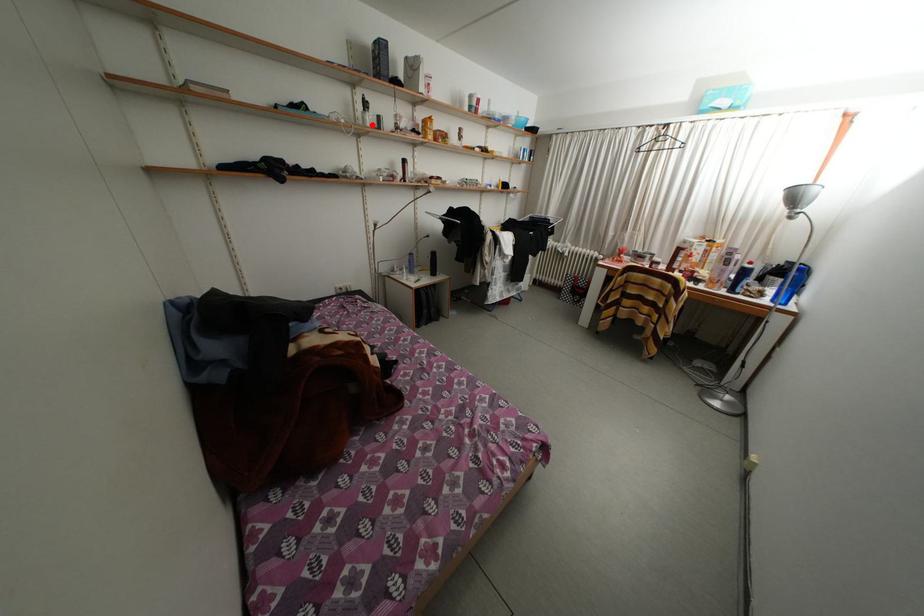
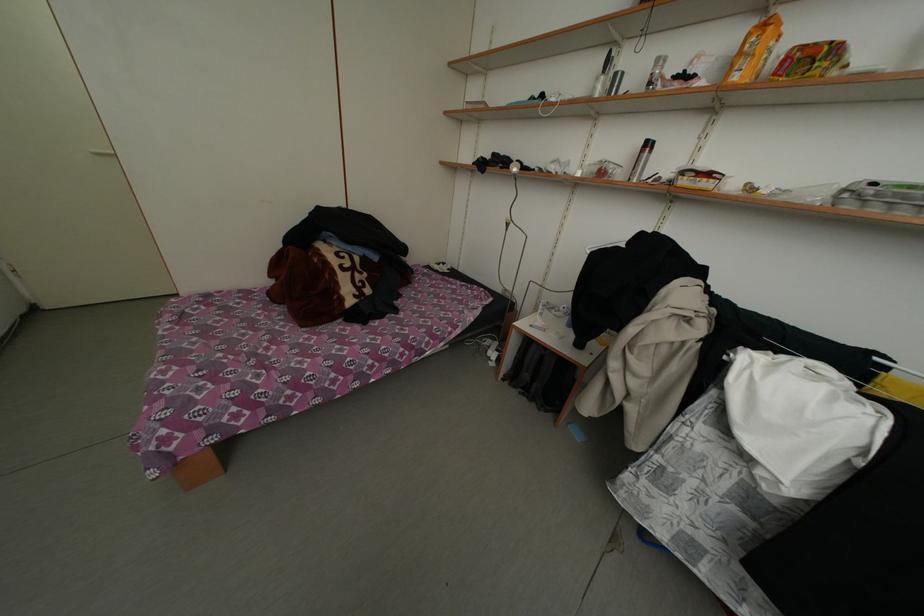
Where in the second image is the point corresponding to the highlighted location from the first image?

(602, 94)